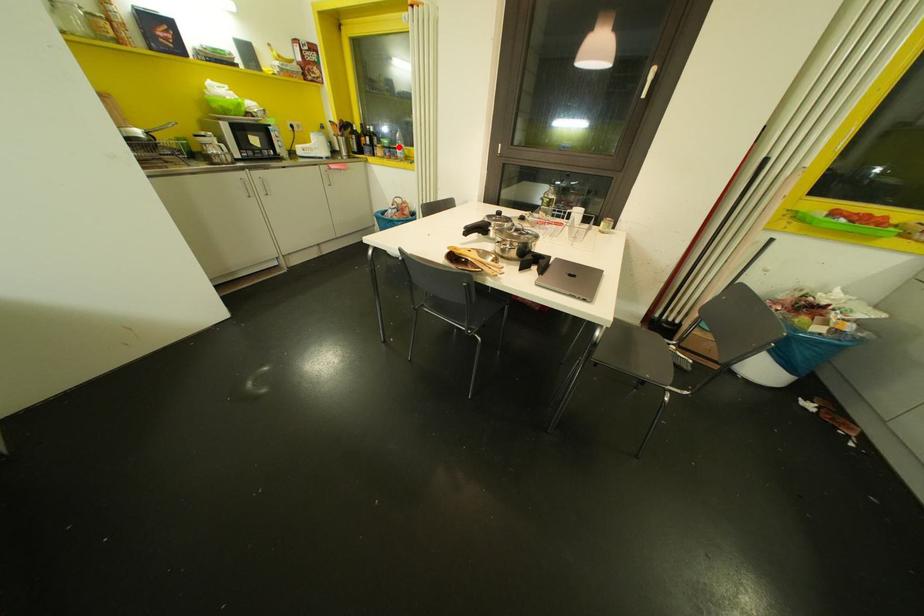
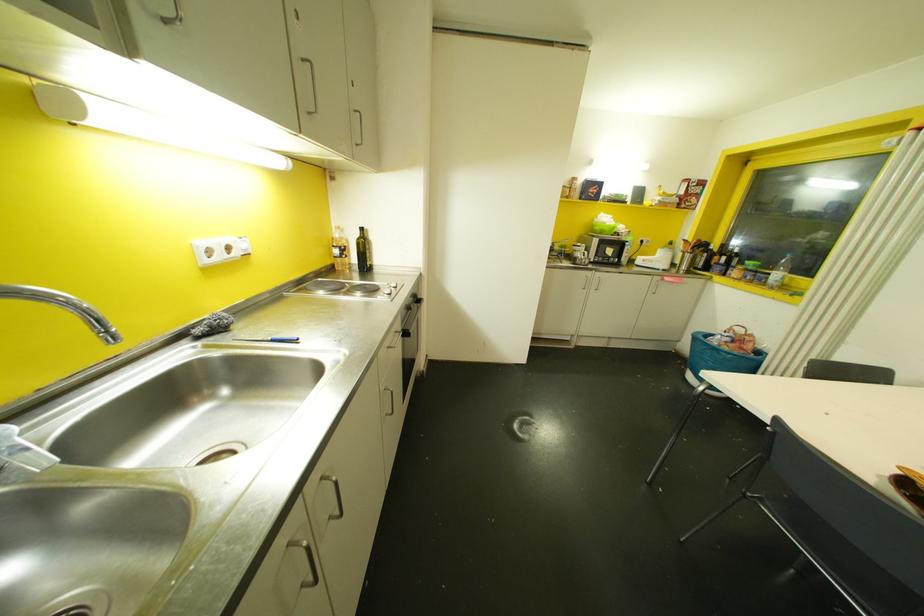
Question: I am providing you with two images of the same scene from different viewpoints. In image1, a red point is highlighted. Considering the same 3D point in image2, which of the following is correct?

Choices:
 (A) It is closer
 (B) It is farther

Answer: (B)